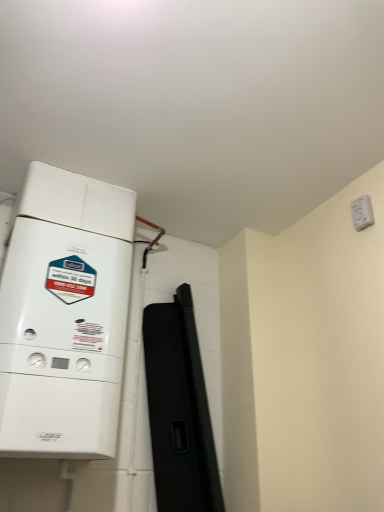
Question: From the image's perspective, relative to white plastic switch at upper right, is white matte boiler at left above or below?

Choices:
 (A) above
 (B) below

Answer: (B)

Question: Is point (97, 193) positioned closer to the camera than point (354, 218)?

Choices:
 (A) farther
 (B) closer

Answer: (A)

Question: Is white matte boiler at left inside the boundaries of white plastic switch at upper right, or outside?

Choices:
 (A) inside
 (B) outside

Answer: (B)

Question: Which is correct: white plastic switch at upper right is inside white matte boiler at left, or outside of it?

Choices:
 (A) outside
 (B) inside

Answer: (A)

Question: In the image, is white plastic switch at upper right on the left side or the right side of white matte boiler at left?

Choices:
 (A) right
 (B) left

Answer: (A)

Question: Relative to white matte boiler at left, is white plastic switch at upper right in front or behind?

Choices:
 (A) front
 (B) behind

Answer: (B)

Question: From their relative heights in the image, would you say white plastic switch at upper right is taller or shorter than white matte boiler at left?

Choices:
 (A) short
 (B) tall

Answer: (A)